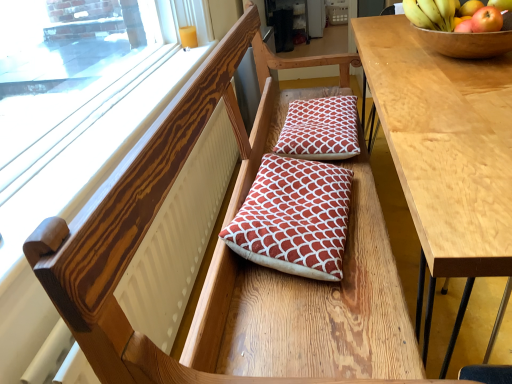
This screenshot has height=384, width=512. What do you see at coordinates (466, 43) in the screenshot? I see `wooden bowl at upper right` at bounding box center [466, 43].

Where is `yellow matte bananas at upper right`? Image resolution: width=512 pixels, height=384 pixels. yellow matte bananas at upper right is located at coordinates (431, 14).

What do you see at coordinates (294, 218) in the screenshot? The height and width of the screenshot is (384, 512). I see `red textured cushion at center, positioned as the first pillow in bottom-to-top order` at bounding box center [294, 218].

In order to face wooden frame at upper left, should I rotate leftwards or rightwards?

Turn left approximately 15.835 degrees to face it.

Find the location of a particular element. wooden frame at upper left is located at coordinates (81, 145).

Describe the element at coordinates (445, 155) in the screenshot. I see `light brown wood table at right` at that location.

The image size is (512, 384). Identify the location of wooden bowl at upper right. (466, 43).

From a real-world perspective, which object stands above the other?

In real-world perspective, wooden bowl at upper right is above.

From their relative heights in the image, would you say red textured cushion at center, which is the second pillow from back to front, is taller or shorter than wooden bowl at upper right?

In the image, red textured cushion at center, which is the second pillow from back to front, appears to be taller than wooden bowl at upper right.

Locate an element on the screen. pillow that is in front of the wooden bowl at upper right is located at coordinates (294, 218).

From the picture: Considering the relative sizes of red matte apple at upper right and yellow matte bananas at upper right in the image provided, is red matte apple at upper right bigger than yellow matte bananas at upper right?

No.

From the picture: Is red matte apple at upper right situated inside yellow matte bananas at upper right or outside?

The correct answer is: outside.

Relative to yellow matte bananas at upper right, is red matte apple at upper right in front or behind?

In the image, red matte apple at upper right appears in front of yellow matte bananas at upper right.

Is point (476, 28) closer or farther from the camera than point (473, 27)?

Clearly, point (476, 28) is closer to the camera than point (473, 27).

Does red matte apple at upper right have a greater width compared to light brown wood table at right?

In fact, red matte apple at upper right might be narrower than light brown wood table at right.

From the image's perspective, is red matte apple at upper right positioned above or below light brown wood table at right?

red matte apple at upper right is above light brown wood table at right.

Would you say light brown wood table at right is part of red matte apple at upper right's contents?

Definitely not — light brown wood table at right is not inside red matte apple at upper right.

Is point (492, 9) positioned after point (378, 108)?

Yes.

Can red quilted cushion at center, placed as the second pillow when sorted from front to back, be found inside wooden bowl at upper right?

That's incorrect, red quilted cushion at center, placed as the second pillow when sorted from front to back, is not inside wooden bowl at upper right.

Considering the sizes of objects wooden bowl at upper right and red quilted cushion at center, the 2th pillow from the bottom, in the image provided, who is thinner, wooden bowl at upper right or red quilted cushion at center, the 2th pillow from the bottom,?

red quilted cushion at center, the 2th pillow from the bottom, is thinner.

From a real-world perspective, relative to red quilted cushion at center, the 2th pillow from the bottom, is wooden bowl at upper right vertically above or below?

wooden bowl at upper right is above red quilted cushion at center, the 2th pillow from the bottom.

Who is bigger, red matte apple at upper right or wooden frame at upper left?

wooden frame at upper left is bigger.

Which of these two, red matte apple at upper right or wooden frame at upper left, stands taller?

Standing taller between the two is red matte apple at upper right.

Is red matte apple at upper right positioned with its back to wooden frame at upper left?

red matte apple at upper right is not turned away from wooden frame at upper left.

Which is closer, (482,30) or (70,135)?

Point (482,30) is closer to the camera than point (70,135).

Consider the image. From a real-world perspective, does red matte apple at upper right sit lower than wooden bowl at upper right?

Actually, red matte apple at upper right is physically above wooden bowl at upper right in the real world.

How much distance is there between red matte apple at upper right and wooden bowl at upper right?

They are 2.63 inches apart.

Is red matte apple at upper right facing towards wooden bowl at upper right?

Yes, red matte apple at upper right is oriented towards wooden bowl at upper right.

Locate an element on the screen. apple on the right of wooden bowl at upper right is located at coordinates (487, 20).

Considering the sizes of red quilted cushion at center, the 2th pillow from the bottom, and red textured cushion at center, which appears as the 2th pillow when viewed from the top, in the image, is red quilted cushion at center, the 2th pillow from the bottom, taller or shorter than red textured cushion at center, which appears as the 2th pillow when viewed from the top,?

red quilted cushion at center, the 2th pillow from the bottom, is shorter than red textured cushion at center, which appears as the 2th pillow when viewed from the top.

Does red quilted cushion at center, placed as the second pillow when sorted from front to back, have a greater width compared to red textured cushion at center, positioned as the first pillow in bottom-to-top order?

In fact, red quilted cushion at center, placed as the second pillow when sorted from front to back, might be narrower than red textured cushion at center, positioned as the first pillow in bottom-to-top order.

Is red quilted cushion at center, placed as the second pillow when sorted from front to back, oriented away from red textured cushion at center, positioned as the first pillow in bottom-to-top order?

No, red quilted cushion at center, placed as the second pillow when sorted from front to back,'s orientation is not away from red textured cushion at center, positioned as the first pillow in bottom-to-top order.

Is red quilted cushion at center, the 2th pillow from the bottom, smaller than red textured cushion at center, the 1th pillow in the front-to-back sequence?

Correct, red quilted cushion at center, the 2th pillow from the bottom, occupies less space than red textured cushion at center, the 1th pillow in the front-to-back sequence.

Identify the location of pillow in front of the wooden bowl at upper right. The height and width of the screenshot is (384, 512). (294, 218).

This screenshot has width=512, height=384. Identify the location of banana that appears behind the red matte apple at upper right. (431, 14).

Considering their positions, is red textured cushion at center, the 1th pillow in the front-to-back sequence, positioned further to red quilted cushion at center, the 1th pillow positioned from the top, than light brown wood table at right?

Among the two, light brown wood table at right is located further to red quilted cushion at center, the 1th pillow positioned from the top.

Estimate the real-world distances between objects in this image. Which object is closer to wooden bowl at upper right, red quilted cushion at center, the 2th pillow from the bottom, or wooden frame at upper left?

red quilted cushion at center, the 2th pillow from the bottom, is positioned closer to the anchor wooden bowl at upper right.

Based on their spatial positions, is wooden bowl at upper right or wooden frame at upper left closer to red textured cushion at center, which is the second pillow from back to front?

Based on the image, wooden frame at upper left appears to be nearer to red textured cushion at center, which is the second pillow from back to front.

Estimate the real-world distances between objects in this image. Which object is closer to red quilted cushion at center, placed as the second pillow when sorted from front to back, yellow matte bananas at upper right or red textured cushion at center, the 1th pillow in the front-to-back sequence?

Based on the image, red textured cushion at center, the 1th pillow in the front-to-back sequence, appears to be nearer to red quilted cushion at center, placed as the second pillow when sorted from front to back.

Consider the image. Which object lies further to the anchor point wooden frame at upper left, wooden bowl at upper right or red matte apple at upper right?

Among the two, red matte apple at upper right is located further to wooden frame at upper left.

Which object lies nearer to the anchor point wooden frame at upper left, yellow matte bananas at upper right or red textured cushion at center, which appears as the 2th pillow when viewed from the top?

The object closer to wooden frame at upper left is red textured cushion at center, which appears as the 2th pillow when viewed from the top.

From the image, which object appears to be nearer to red matte apple at upper right, wooden bowl at upper right or red quilted cushion at center, placed as the second pillow when sorted from front to back?

wooden bowl at upper right.

When comparing their distances from yellow matte bananas at upper right, does wooden bowl at upper right or red quilted cushion at center, the 2th pillow from the bottom, seem further?

red quilted cushion at center, the 2th pillow from the bottom, lies further to yellow matte bananas at upper right than the other object.

Locate an element on the screen. apple that lies between yellow matte bananas at upper right and red textured cushion at center, positioned as the first pillow in bottom-to-top order, from top to bottom is located at coordinates (487, 20).

This screenshot has width=512, height=384. I want to click on banana situated between wooden frame at upper left and red matte apple at upper right from left to right, so point(431,14).

You are a GUI agent. You are given a task and a screenshot of the screen. Output one action in this format:
    pyautogui.click(x=<x>, y=<y>)
    Task: Click on the apple between light brown wood table at right and yellow matte bananas at upper right in the front-back direction
    
    Given the screenshot: What is the action you would take?
    pyautogui.click(x=487, y=20)

Image resolution: width=512 pixels, height=384 pixels. Identify the location of pillow between light brown wood table at right and yellow matte bananas at upper right from front to back. (294, 218).